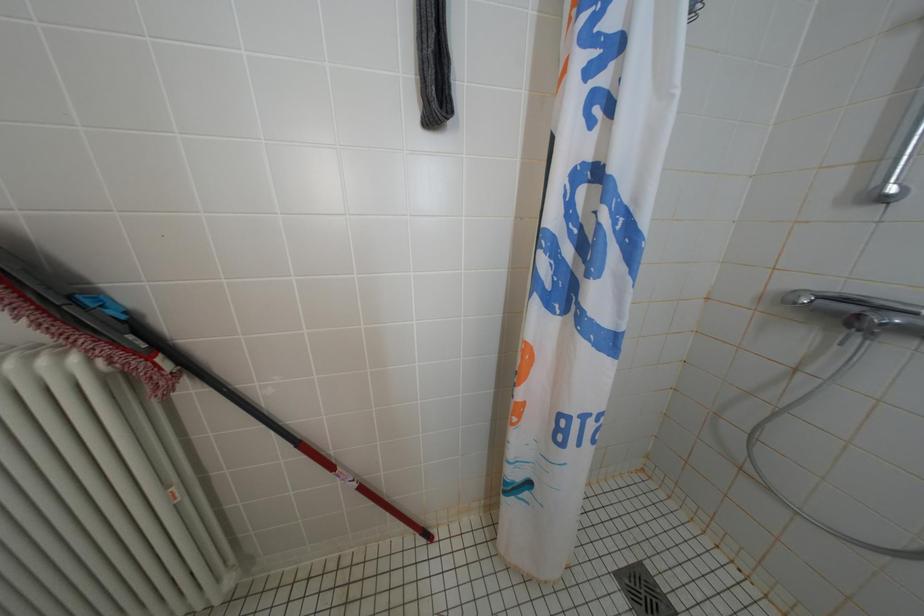
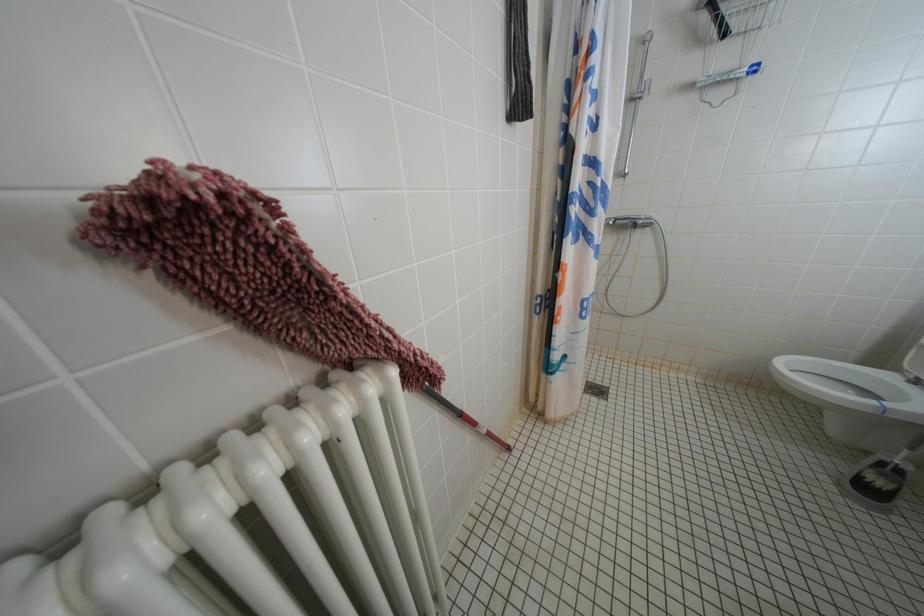
Question: The camera is either moving clockwise (left) or counter-clockwise (right) around the object. The first image is from the beginning of the video and the second image is from the end. Is the camera moving left or right when shooting the video?

Choices:
 (A) Left
 (B) Right

Answer: (A)